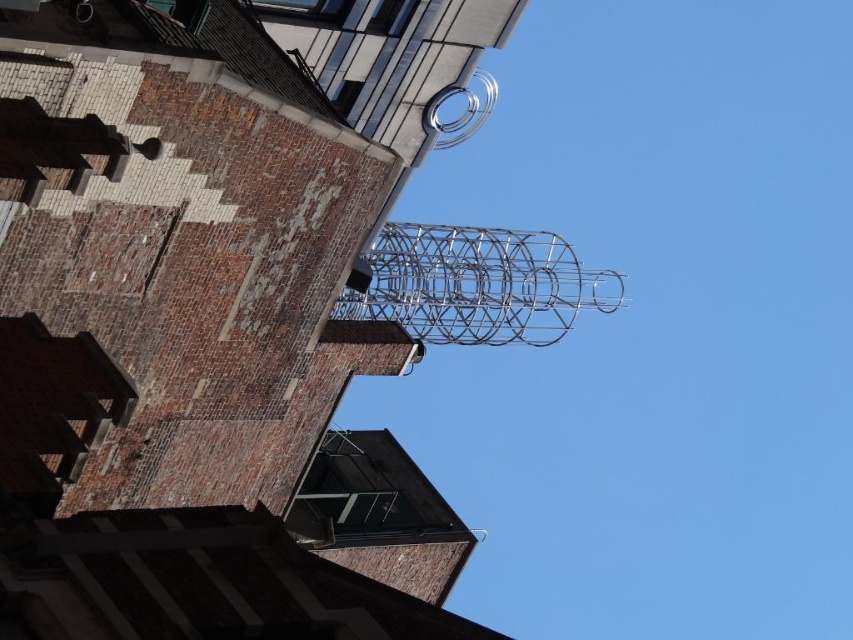
You are an architect examining the brick building and its modern additions. You notice the silver metallic tower at upper center and the silver metallic wire at upper center. Which of these two objects is located below the other?

The silver metallic tower at upper center is positioned under the silver metallic wire at upper center.

You are an architect designing a new sculpture for the brick building. You have two options from the image, the silver metallic tower at upper center and the silver metallic wire at upper center. Which one takes up more space in the image?

The silver metallic wire at upper center takes up more space than the silver metallic tower at upper center because the silver metallic tower at upper center occupies less space than silver metallic wire at upper center.

Based on the photo, you are an architect designing a new sculpture for the brick building. You want to ensure the sculpture doesn not block the view of the building facade. Based on the image, which object between the silver metallic tower at upper center and the silver metallic wire at upper center is narrower and thus less likely to obstruct the view?

The silver metallic tower at upper center is narrower than the silver metallic wire at upper center, so it is less likely to obstruct the view.